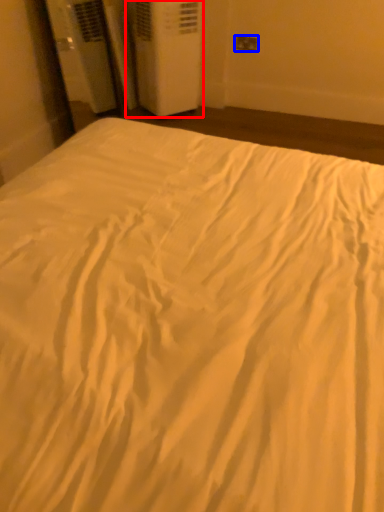
Question: Among these objects, which one is nearest to the camera, air conditioning (highlighted by a red box) or electric outlet (highlighted by a blue box)?

Choices:
 (A) air conditioning
 (B) electric outlet

Answer: (A)